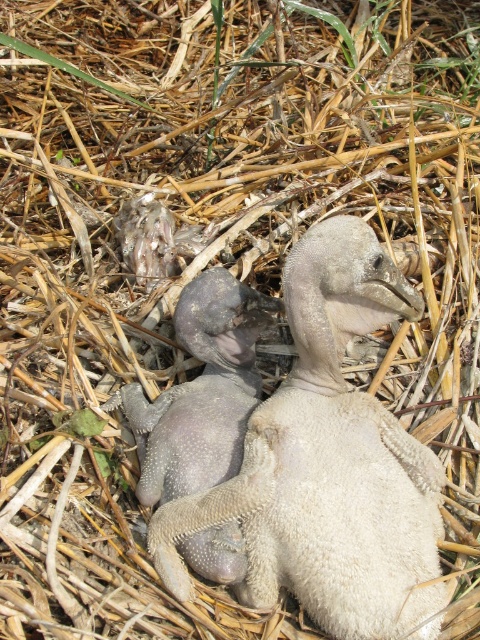
Looking at this image, which of these two, gray downy duckling at center or purple fuzzy duckling at center, stands taller?

With more height is gray downy duckling at center.

Between point (251, 461) and point (252, 352), which one is positioned behind?

Point (252, 352)

Which is behind, point (204, 520) or point (211, 333)?

Point (211, 333)

Where is `gray downy duckling at center`? The height and width of the screenshot is (640, 480). gray downy duckling at center is located at coordinates (328, 465).